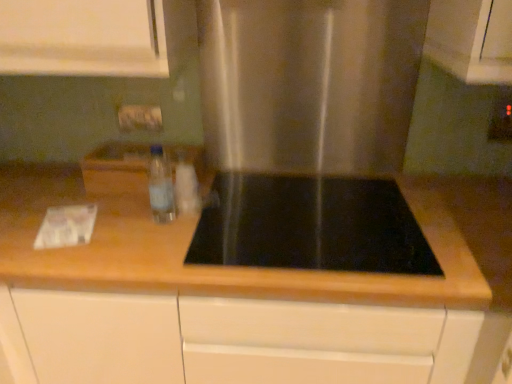
This screenshot has width=512, height=384. I want to click on free space in front of clear plastic bottle at center, the second bottle viewed from the right, so click(x=150, y=243).